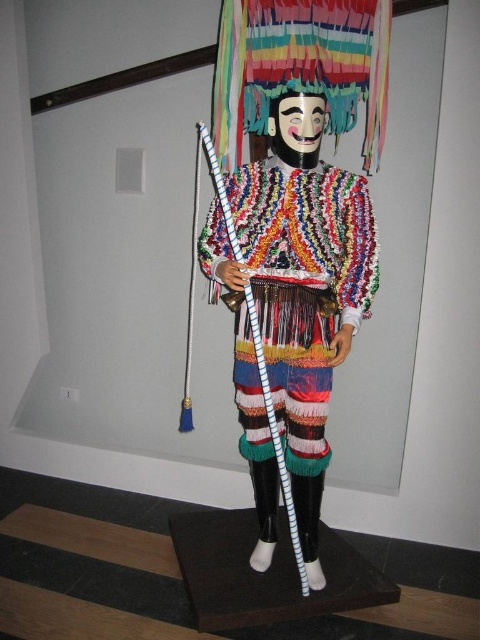
Who is more forward, (328, 216) or (267, 186)?

Positioned in front is point (328, 216).

Find the location of a particular element. Image resolution: width=480 pixels, height=640 pixels. knitted/multicolored figure at center is located at coordinates (294, 228).